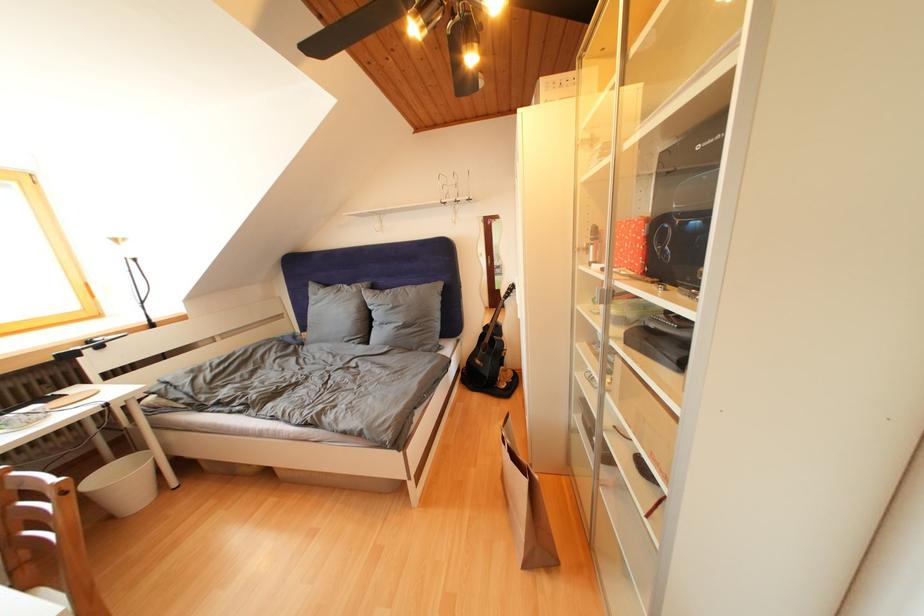
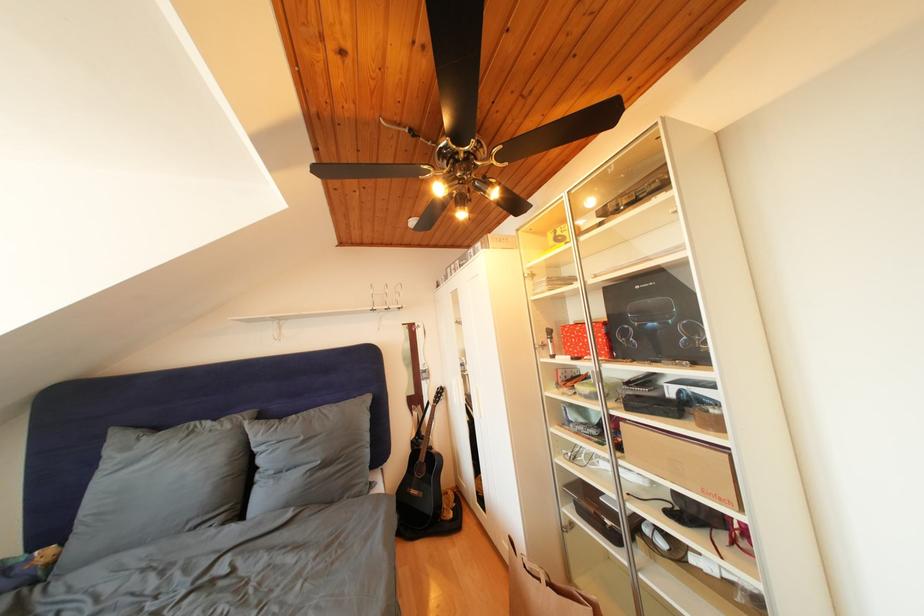
Locate, in the second image, the point that corresponds to pixel 398 310 in the first image.

(310, 444)